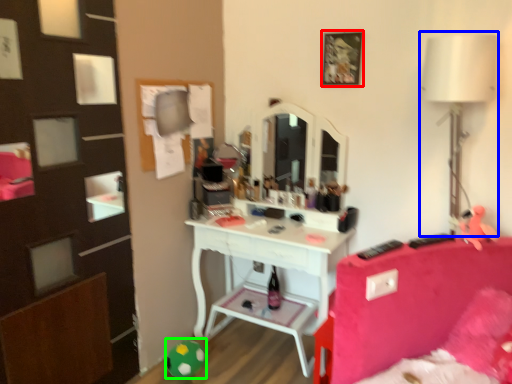
Question: Which object is the closest to the picture frame (highlighted by a red box)? Choose among these: table lamp (highlighted by a blue box) or toy (highlighted by a green box).

Choices:
 (A) table lamp
 (B) toy

Answer: (A)